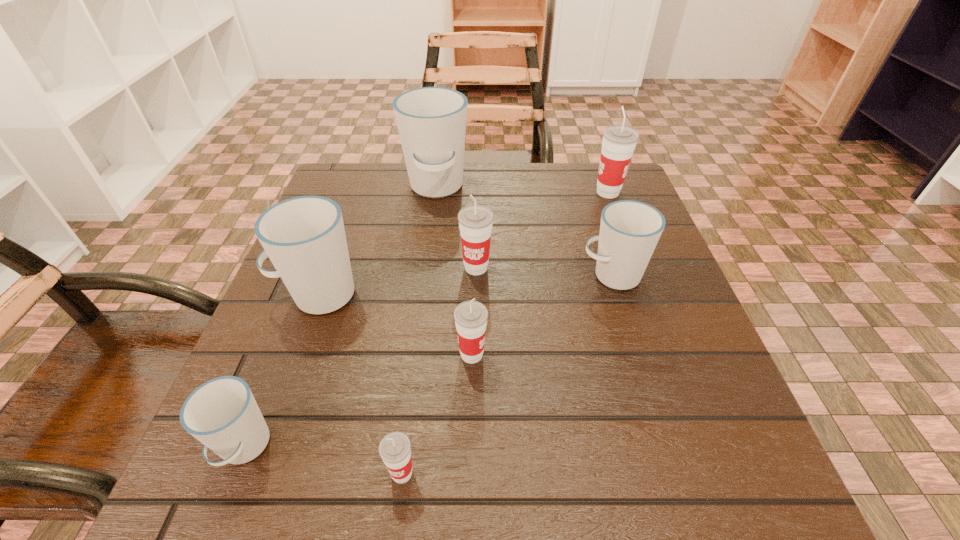
At what (x,y) coordinates should I click in order to perform the action: click on the smallest red cup. Please return your answer as a coordinate pair (x, y). This screenshot has height=540, width=960. Looking at the image, I should click on (395, 448).

Identify the location of the leftmost red cup. The width and height of the screenshot is (960, 540). (x=395, y=448).

Locate an element on the screen. The image size is (960, 540). vacant space located 0.310m with a handle on the side of the biggest white cup is located at coordinates (420, 308).

Identify the location of vacant space located on the side of the farthest red cup with the logo. (468, 192).

The image size is (960, 540). I want to click on free region located 0.400m on the side of the farthest red cup with the logo, so [431, 192].

Locate an element on the screen. The height and width of the screenshot is (540, 960). vacant space located 0.350m on the side of the farthest red cup with the logo is located at coordinates (451, 192).

Where is `free space located 0.330m on the side of the third smallest red cup with the logo`? The image size is (960, 540). free space located 0.330m on the side of the third smallest red cup with the logo is located at coordinates (474, 437).

Find the location of a particular element. free space located on the side of the second nearest red cup with the logo is located at coordinates coord(712,355).

The image size is (960, 540). I want to click on free region located with a handle on the side of the third biggest white cup, so click(x=435, y=275).

The width and height of the screenshot is (960, 540). What are the coordinates of `vacant space located 0.300m with a handle on the side of the third biggest white cup` in the screenshot? It's located at (430, 275).